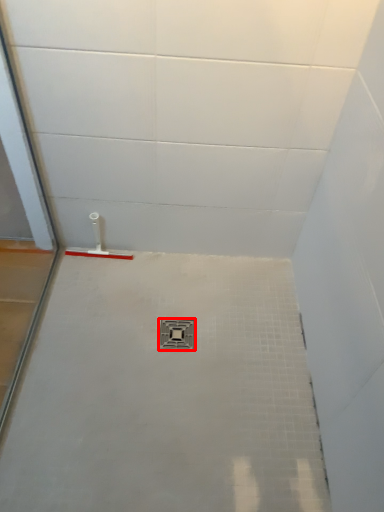
Question: Where is plumbing fixture (annotated by the red box) located in relation to shower in the image?

Choices:
 (A) left
 (B) right

Answer: (B)